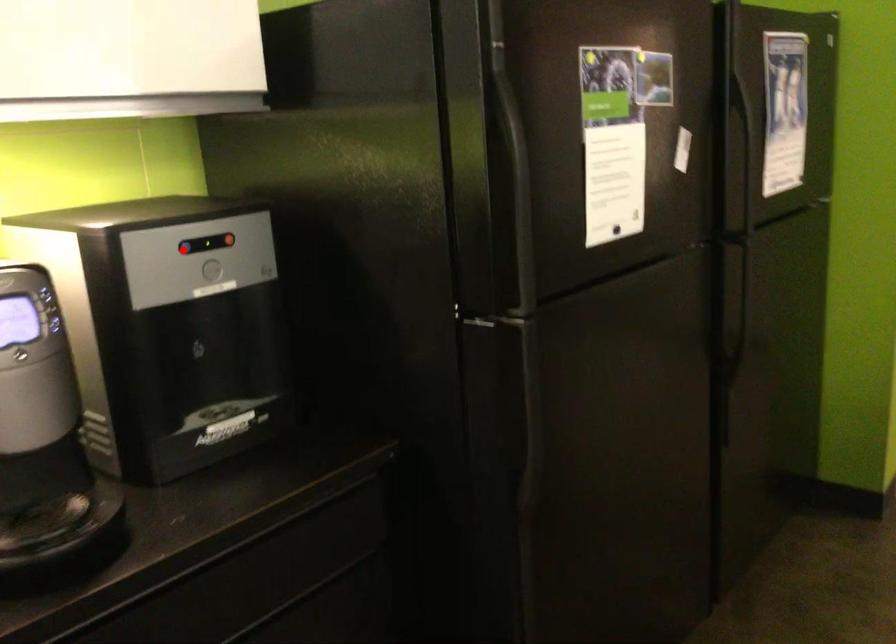
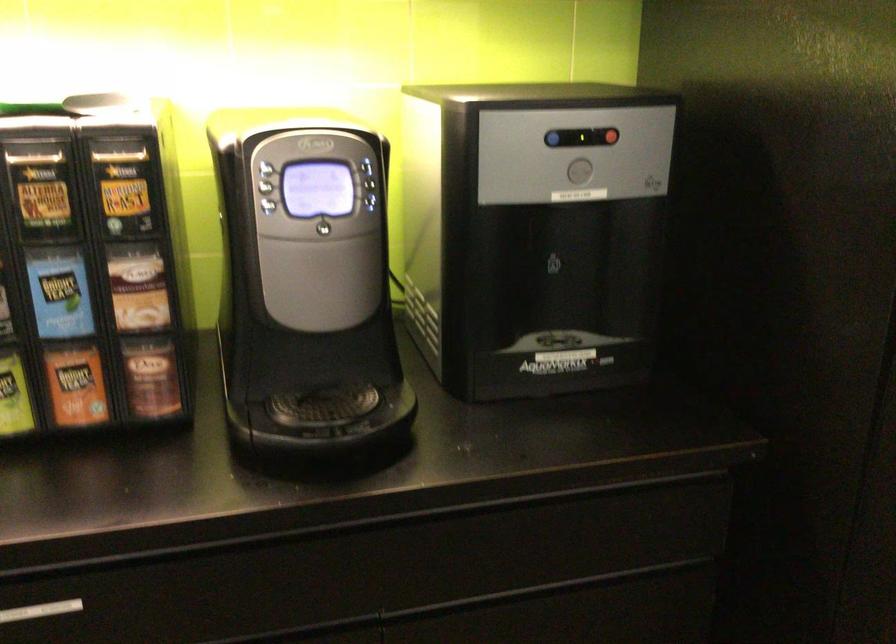
Question: I am providing you with two images of the same scene from different viewpoints. A red point is marked on the first image. At the location where the point appears in image 1, is it still visible in image 2?

Choices:
 (A) Yes
 (B) No

Answer: (A)